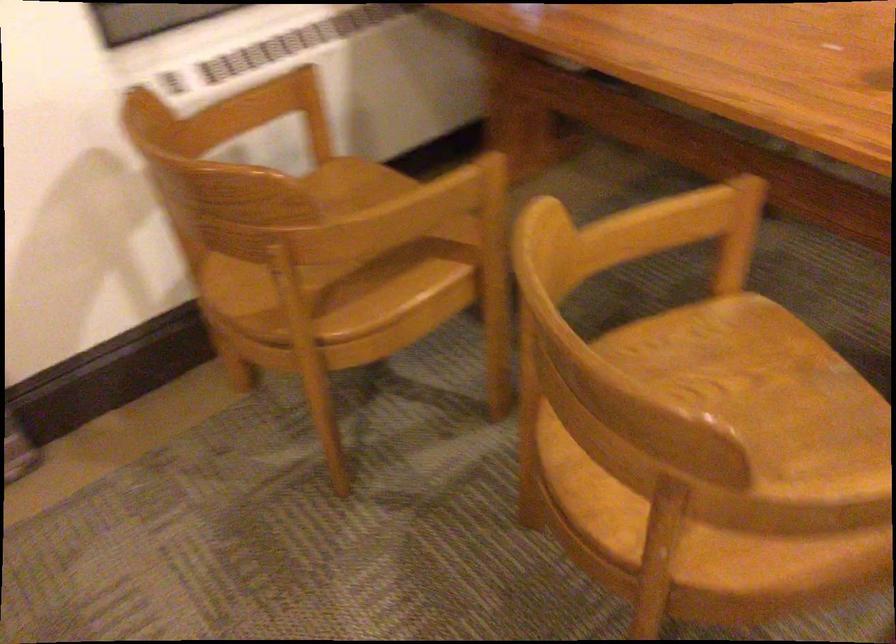
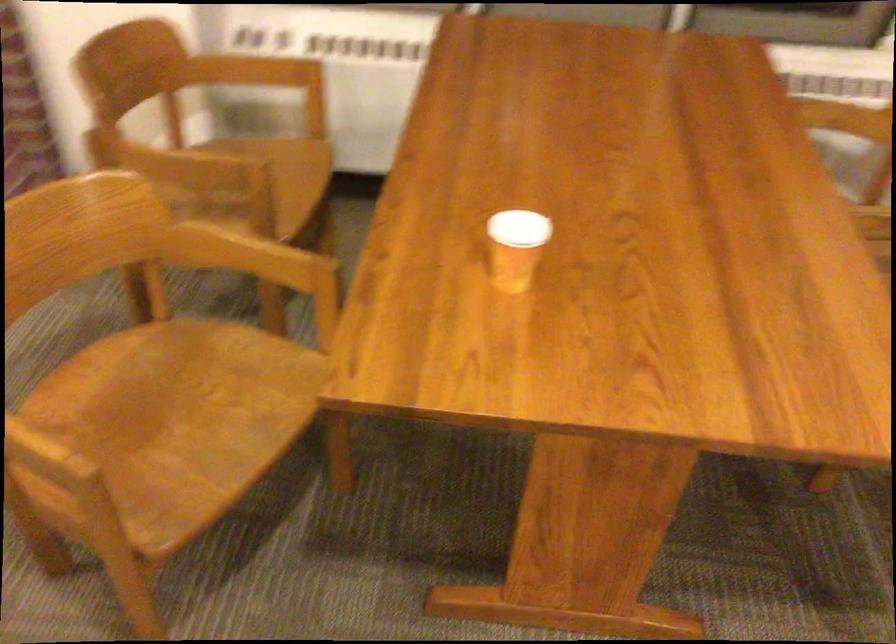
Locate, in the second image, the point that corresponds to [657,225] in the first image.

(248, 257)